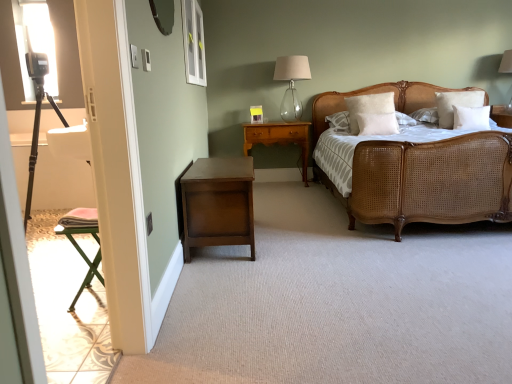
Question: From the image's perspective, is woven cane bed at center positioned above or below white soft pillow at upper right, which is the fourth pillow from left to right?

Choices:
 (A) above
 (B) below

Answer: (B)

Question: Considering the positions of woven cane bed at center and white soft pillow at upper right, which is the fourth pillow from left to right, in the image, is woven cane bed at center wider or thinner than white soft pillow at upper right, which is the fourth pillow from left to right,?

Choices:
 (A) wide
 (B) thin

Answer: (A)

Question: Which object is the closest to the white soft pillow at upper right, marked as the third pillow in a left-to-right arrangement?

Choices:
 (A) woven cane bed at center
 (B) dark wood nightstand at lower left, the second nightstand positioned from the back
 (C) clear glass table lamp at upper center
 (D) white soft pillow at upper center, placed as the 1th pillow when sorted from left to right
 (E) white soft pillow at center, which is the 3th pillow from right to left

Answer: (E)

Question: Based on their relative distances, which object is farther from the white soft pillow at upper right, which is the fourth pillow from left to right?

Choices:
 (A) matte silver mirror at upper center
 (B) woven cane bed at center
 (C) clear glass table lamp at upper center
 (D) white soft pillow at upper center, placed as the fourth pillow when sorted from right to left
 (E) transparent glass window at upper center

Answer: (A)